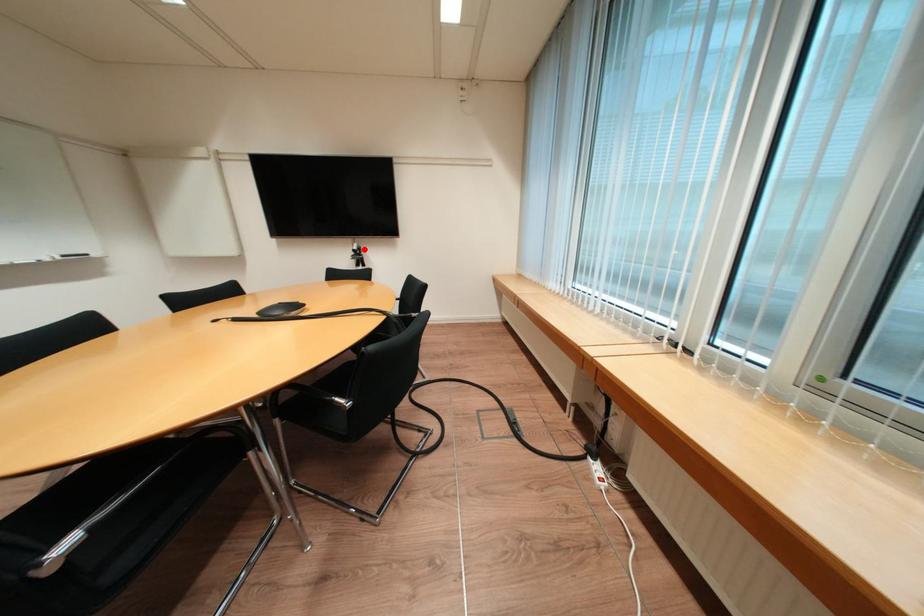
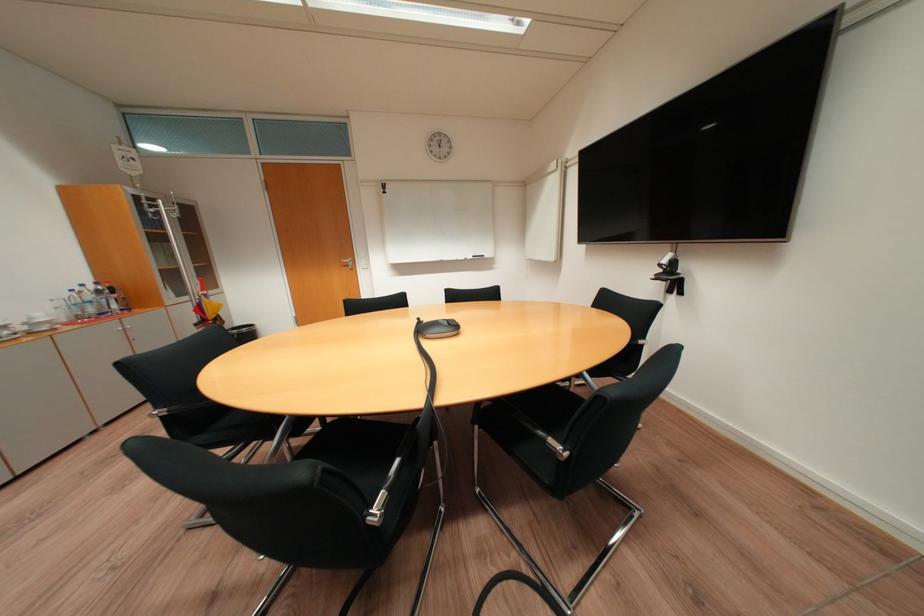
The point at the highlighted location is marked in the first image. Where is the corresponding point in the second image?

(673, 262)